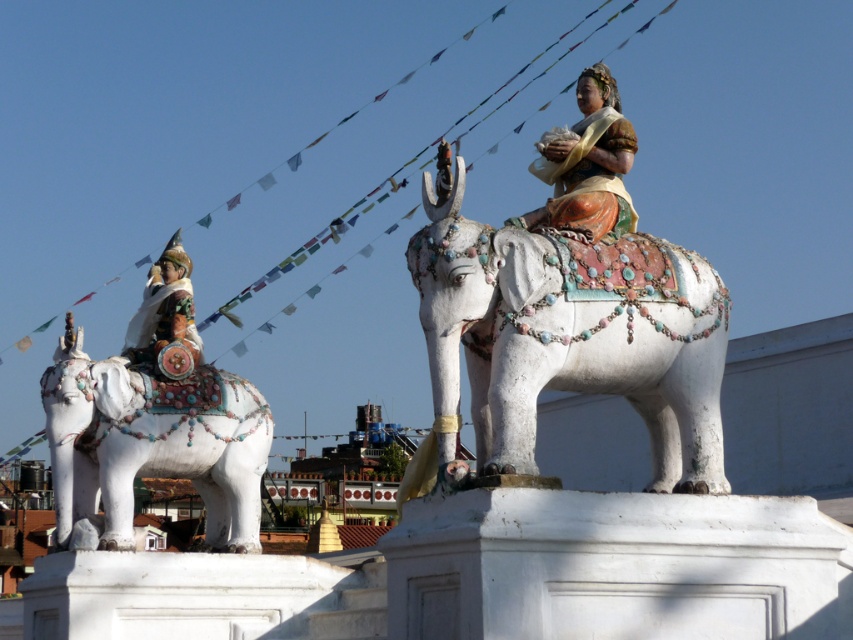
You are an art conservator examining the statues from a distance. The white glossy elephant at left and the larger elephant on the right are both on the pedestal. Based on their positions, which elephant is closer to the edge of the pedestal?

The white glossy elephant at left is located at point (149, 445), which is closer to the edge of the pedestal compared to the larger elephant on the right, so it is closer.

You are an art conservator tasked with moving a 15 feet long protective covering to cover both the white glossy elephant at center and the polychrome painted statue at upper right. Given their distance apart, will the covering be sufficient to cover both?

The white glossy elephant at center and the polychrome painted statue at upper right are 15.62 feet apart from each other. Since the protective covering is 15 feet long, it may not be long enough to fully cover both objects as the distance between them exceeds the covering length.

You are an art curator planning to move the white glossy elephant at center and the polychrome painted statue at upper right to a new exhibition space. The new space has a narrow corridor that only allows one object to pass through at a time. Based on their positions in the current scene, which object should be moved first to ensure the path remains clear for the other?

The white glossy elephant at center should be moved first because it is positioned on the left side of the polychrome painted statue at upper right. Moving it first would allow the larger statue to pass through the corridor without obstruction.